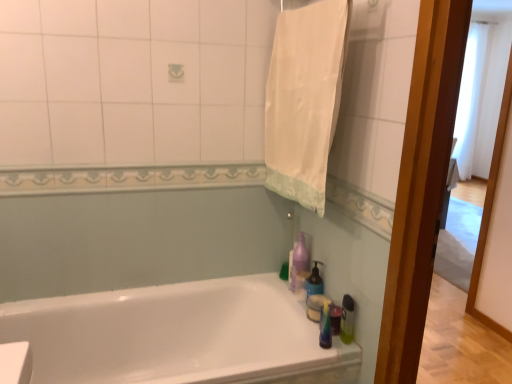
What do you see at coordinates (314, 282) in the screenshot?
I see `translucent plastic soap dispenser at right, the 2th cleaning product when ordered from back to front` at bounding box center [314, 282].

The width and height of the screenshot is (512, 384). Find the location of `purple glossy bottle at upper right, which is the third cleaning product in front-to-back order`. purple glossy bottle at upper right, which is the third cleaning product in front-to-back order is located at coordinates (298, 261).

Measure the distance between white glossy bathtub at lower center and camera.

white glossy bathtub at lower center is 1.51 meters from camera.

What do you see at coordinates (178, 336) in the screenshot? I see `white glossy bathtub at lower center` at bounding box center [178, 336].

The height and width of the screenshot is (384, 512). Identify the location of translucent plastic soap dispenser at right, arranged as the second cleaning product when viewed from the front. (314, 282).

From a real-world perspective, relative to white cotton towel at upper right, is translucent plastic soap dispenser at right, arranged as the second cleaning product when viewed from the front, vertically above or below?

translucent plastic soap dispenser at right, arranged as the second cleaning product when viewed from the front, is situated lower than white cotton towel at upper right in the real world.

Is translucent plastic soap dispenser at right, arranged as the second cleaning product when viewed from the front, next to white cotton towel at upper right?

There is a gap between translucent plastic soap dispenser at right, arranged as the second cleaning product when viewed from the front, and white cotton towel at upper right.

Is translucent plastic soap dispenser at right, the 2th cleaning product when ordered from back to front, not inside white cotton towel at upper right?

translucent plastic soap dispenser at right, the 2th cleaning product when ordered from back to front, lies outside white cotton towel at upper right's area.

Considering the relative positions of translucent plastic soap dispenser at right, the 2th cleaning product when ordered from back to front, and white cotton towel at upper right in the image provided, is translucent plastic soap dispenser at right, the 2th cleaning product when ordered from back to front, in front of white cotton towel at upper right?

No, translucent plastic soap dispenser at right, the 2th cleaning product when ordered from back to front, is further to the viewer.

Can you confirm if white glossy bathtub at lower center is smaller than green translucent bottle at right, which is the first cleaning product from front to back?

No.

Which is less distant, (189, 312) or (343, 309)?

Point (189, 312) is positioned farther from the camera compared to point (343, 309).

In the image, is white glossy bathtub at lower center positioned in front of or behind green translucent bottle at right, which is the first cleaning product from front to back?

Clearly, white glossy bathtub at lower center is in front of green translucent bottle at right, which is the first cleaning product from front to back.

Between white glossy bathtub at lower center and green translucent bottle at right, arranged as the 3th cleaning product when viewed from the back, which one has more height?

white glossy bathtub at lower center is taller.

Is purple glossy bottle at upper right, which is the third cleaning product in front-to-back order, inside or outside of white cotton towel at upper right?

purple glossy bottle at upper right, which is the third cleaning product in front-to-back order, is not enclosed by white cotton towel at upper right.

Is the surface of purple glossy bottle at upper right, which is the third cleaning product in front-to-back order, in direct contact with white cotton towel at upper right?

purple glossy bottle at upper right, which is the third cleaning product in front-to-back order, and white cotton towel at upper right are not in contact.

Does point (300, 273) appear closer or farther from the camera than point (318, 115)?

Clearly, point (300, 273) is more distant from the camera than point (318, 115).

Which is behind, purple glossy bottle at upper right, which is the third cleaning product in front-to-back order, or white cotton towel at upper right?

purple glossy bottle at upper right, which is the third cleaning product in front-to-back order, is further away from the camera.

Which of these two, green translucent bottle at right, arranged as the 3th cleaning product when viewed from the back, or purple glossy bottle at upper right, the first cleaning product in the back-to-front sequence, stands shorter?

green translucent bottle at right, arranged as the 3th cleaning product when viewed from the back, is shorter.

Is green translucent bottle at right, which is the first cleaning product from front to back, turned away from purple glossy bottle at upper right, which is the third cleaning product in front-to-back order?

No, purple glossy bottle at upper right, which is the third cleaning product in front-to-back order, is not at the back of green translucent bottle at right, which is the first cleaning product from front to back.

Measure the distance between green translucent bottle at right, which is the first cleaning product from front to back, and purple glossy bottle at upper right, which is the third cleaning product in front-to-back order.

A distance of 14.37 inches exists between green translucent bottle at right, which is the first cleaning product from front to back, and purple glossy bottle at upper right, which is the third cleaning product in front-to-back order.

Is green translucent bottle at right, which is the first cleaning product from front to back, far away from purple glossy bottle at upper right, which is the third cleaning product in front-to-back order?

green translucent bottle at right, which is the first cleaning product from front to back, is near purple glossy bottle at upper right, which is the third cleaning product in front-to-back order, not far away.

Between white cotton towel at upper right and translucent plastic soap dispenser at right, the 2th cleaning product when ordered from back to front, which one has more height?

Standing taller between the two is white cotton towel at upper right.

Would you say white cotton towel at upper right is inside or outside translucent plastic soap dispenser at right, arranged as the second cleaning product when viewed from the front?

The correct answer is: outside.

Locate an element on the screen. This screenshot has height=384, width=512. bath towel located on the left of translucent plastic soap dispenser at right, the 2th cleaning product when ordered from back to front is located at coordinates (304, 100).

Measure the distance from white cotton towel at upper right to translucent plastic soap dispenser at right, the 2th cleaning product when ordered from back to front.

A distance of 28.14 inches exists between white cotton towel at upper right and translucent plastic soap dispenser at right, the 2th cleaning product when ordered from back to front.

From a real-world perspective, is translucent plastic soap dispenser at right, arranged as the second cleaning product when viewed from the front, on green translucent bottle at right, which is the first cleaning product from front to back?

Correct, in the physical world, translucent plastic soap dispenser at right, arranged as the second cleaning product when viewed from the front, is higher than green translucent bottle at right, which is the first cleaning product from front to back.

Between translucent plastic soap dispenser at right, the 2th cleaning product when ordered from back to front, and green translucent bottle at right, which is the first cleaning product from front to back, which one has larger size?

translucent plastic soap dispenser at right, the 2th cleaning product when ordered from back to front, is bigger.

Between translucent plastic soap dispenser at right, the 2th cleaning product when ordered from back to front, and green translucent bottle at right, arranged as the 3th cleaning product when viewed from the back, which one appears on the left side from the viewer's perspective?

translucent plastic soap dispenser at right, the 2th cleaning product when ordered from back to front, is more to the left.

Is translucent plastic soap dispenser at right, the 2th cleaning product when ordered from back to front, with green translucent bottle at right, which is the first cleaning product from front to back?

No, translucent plastic soap dispenser at right, the 2th cleaning product when ordered from back to front, is not making contact with green translucent bottle at right, which is the first cleaning product from front to back.

Can you see white cotton towel at upper right touching green translucent bottle at right, arranged as the 3th cleaning product when viewed from the back?

white cotton towel at upper right is not next to green translucent bottle at right, arranged as the 3th cleaning product when viewed from the back, and they're not touching.

From the picture: Is white cotton towel at upper right located outside green translucent bottle at right, which is the first cleaning product from front to back?

white cotton towel at upper right is positioned outside green translucent bottle at right, which is the first cleaning product from front to back.

Is white cotton towel at upper right aimed at green translucent bottle at right, arranged as the 3th cleaning product when viewed from the back?

No, white cotton towel at upper right does not turn towards green translucent bottle at right, arranged as the 3th cleaning product when viewed from the back.

Is point (308, 190) closer or farther from the camera than point (343, 336)?

Point (308, 190) appears to be closer to the viewer than point (343, 336).

There is a white cotton towel at upper right. Where is `the 2nd cleaning product below it (from a real-world perspective)`? Image resolution: width=512 pixels, height=384 pixels. the 2nd cleaning product below it (from a real-world perspective) is located at coordinates (314, 282).

Find the location of a particular element. This screenshot has height=384, width=512. the 3rd cleaning product to the right of the white glossy bathtub at lower center, starting your count from the anchor is located at coordinates (347, 319).

From the image, which object appears to be farther from white glossy bathtub at lower center, white cotton towel at upper right or green translucent bottle at right, arranged as the 3th cleaning product when viewed from the back?

Among the two, white cotton towel at upper right is located further to white glossy bathtub at lower center.

From the image, which object appears to be nearer to white glossy bathtub at lower center, translucent plastic soap dispenser at right, the 2th cleaning product when ordered from back to front, or purple glossy bottle at upper right, which is the third cleaning product in front-to-back order?

purple glossy bottle at upper right, which is the third cleaning product in front-to-back order, lies closer to white glossy bathtub at lower center than the other object.

Considering their positions, is white cotton towel at upper right positioned closer to purple glossy bottle at upper right, the first cleaning product in the back-to-front sequence, than translucent plastic soap dispenser at right, the 2th cleaning product when ordered from back to front?

Among the two, translucent plastic soap dispenser at right, the 2th cleaning product when ordered from back to front, is located nearer to purple glossy bottle at upper right, the first cleaning product in the back-to-front sequence.

When comparing their distances from white cotton towel at upper right, does translucent plastic soap dispenser at right, arranged as the second cleaning product when viewed from the front, or green translucent bottle at right, arranged as the 3th cleaning product when viewed from the back, seem further?

green translucent bottle at right, arranged as the 3th cleaning product when viewed from the back, is further to white cotton towel at upper right.

Based on their spatial positions, is white cotton towel at upper right or white glossy bathtub at lower center closer to green translucent bottle at right, which is the first cleaning product from front to back?

Based on the image, white glossy bathtub at lower center appears to be nearer to green translucent bottle at right, which is the first cleaning product from front to back.

Estimate the real-world distances between objects in this image. Which object is closer to green translucent bottle at right, which is the first cleaning product from front to back, purple glossy bottle at upper right, which is the third cleaning product in front-to-back order, or white cotton towel at upper right?

purple glossy bottle at upper right, which is the third cleaning product in front-to-back order, is positioned closer to the anchor green translucent bottle at right, which is the first cleaning product from front to back.

Estimate the real-world distances between objects in this image. Which object is further from translucent plastic soap dispenser at right, the 2th cleaning product when ordered from back to front, green translucent bottle at right, which is the first cleaning product from front to back, or white glossy bathtub at lower center?

Among the two, white glossy bathtub at lower center is located further to translucent plastic soap dispenser at right, the 2th cleaning product when ordered from back to front.

Which object lies further to the anchor point translucent plastic soap dispenser at right, the 2th cleaning product when ordered from back to front, white cotton towel at upper right or white glossy bathtub at lower center?

The object further to translucent plastic soap dispenser at right, the 2th cleaning product when ordered from back to front, is white cotton towel at upper right.

What are the coordinates of `cleaning product between white cotton towel at upper right and translucent plastic soap dispenser at right, arranged as the second cleaning product when viewed from the front, vertically` in the screenshot? It's located at (298, 261).

Where is `cleaning product positioned between green translucent bottle at right, arranged as the 3th cleaning product when viewed from the back, and purple glossy bottle at upper right, the first cleaning product in the back-to-front sequence, from near to far`? cleaning product positioned between green translucent bottle at right, arranged as the 3th cleaning product when viewed from the back, and purple glossy bottle at upper right, the first cleaning product in the back-to-front sequence, from near to far is located at coordinates (314, 282).